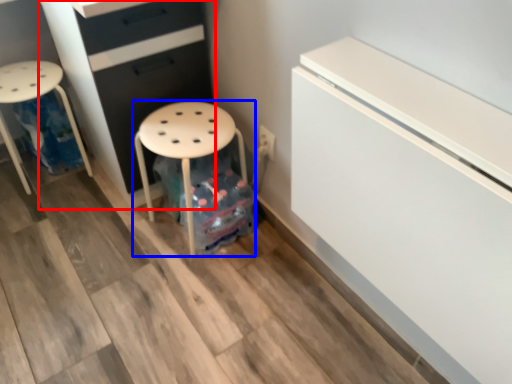
Question: Which point is closer to the camera, chest of drawers (highlighted by a red box) or stool (highlighted by a blue box)?

Choices:
 (A) chest of drawers
 (B) stool

Answer: (A)